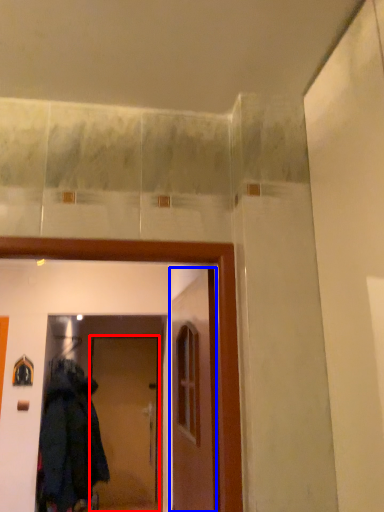
Question: Which object is closer to the camera taking this photo, door (highlighted by a red box) or door (highlighted by a blue box)?

Choices:
 (A) door
 (B) door

Answer: (B)